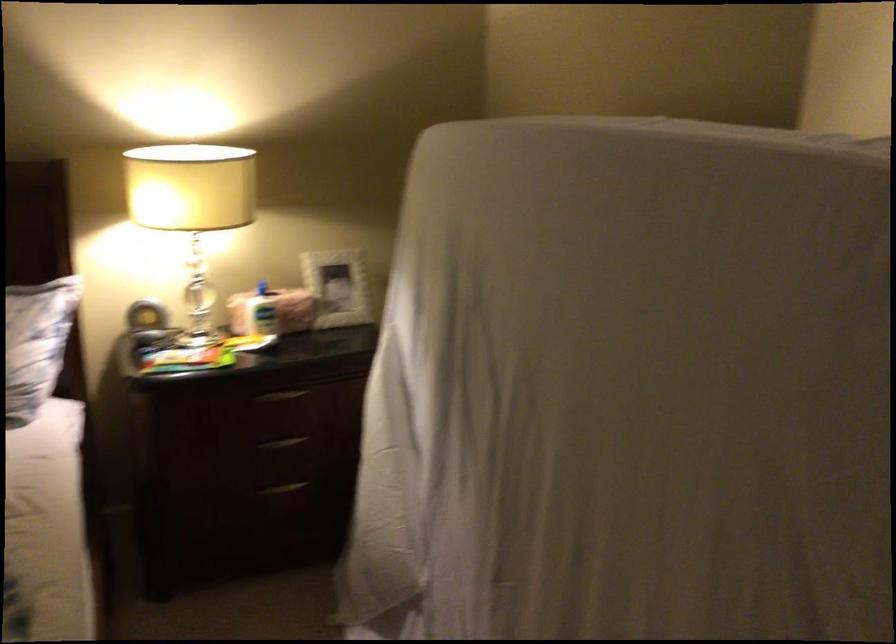
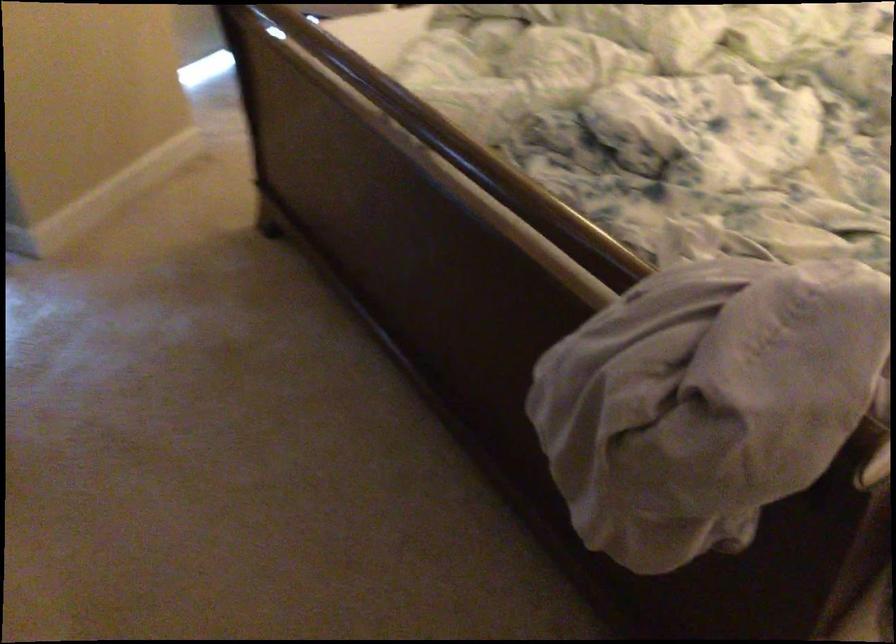
Based on the continuous images, in which direction is the camera rotating?

The camera's rotation is toward left-down.